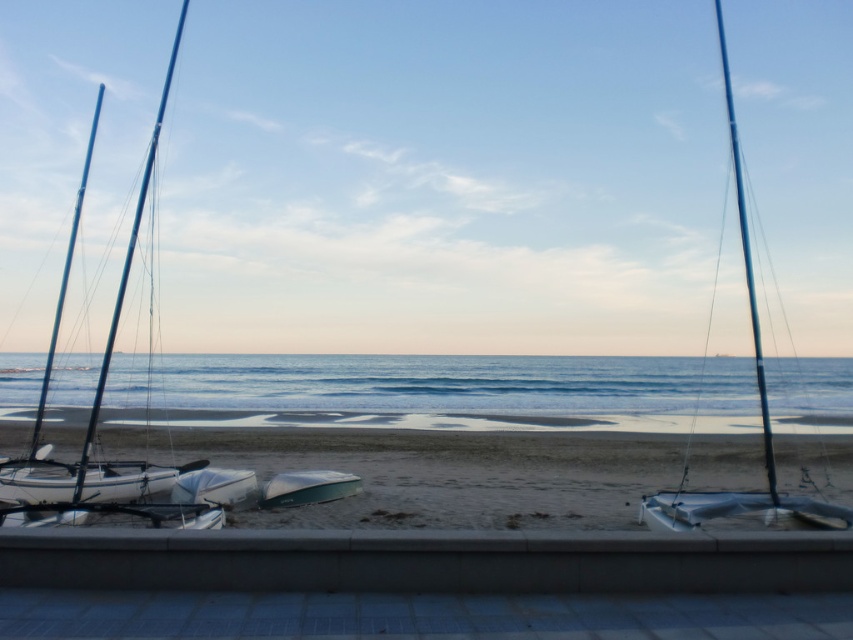
Which of these two, white matte sailboat at left or green matte boat at center, stands taller?

Standing taller between the two is white matte sailboat at left.

Who is positioned more to the right, white matte sailboat at left or green matte boat at center?

Positioned to the right is green matte boat at center.

Where is `white matte sailboat at left`? The image size is (853, 640). white matte sailboat at left is located at coordinates (97, 422).

Measure the distance between point (422, 468) and camera.

16.11 meters

From the picture: Does smooth sand at lower center have a lesser height compared to white matte sailboat at center?

No, smooth sand at lower center is not shorter than white matte sailboat at center.

Where is `smooth sand at lower center`? The image size is (853, 640). smooth sand at lower center is located at coordinates (434, 470).

This screenshot has width=853, height=640. I want to click on smooth sand at lower center, so click(x=434, y=470).

Does white matte sailboat at left have a larger size compared to white matte sailboat at center?

Indeed, white matte sailboat at left has a larger size compared to white matte sailboat at center.

Is point (181, 465) less distant than point (193, 477)?

That is False.

The image size is (853, 640). Find the location of `white matte sailboat at left`. white matte sailboat at left is located at coordinates (97, 422).